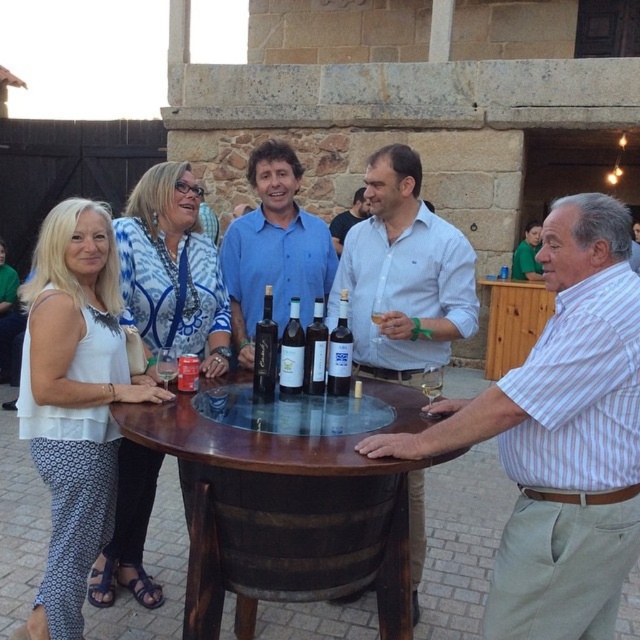
What do you see at coordinates (561, 436) in the screenshot?
I see `white striped shirt at center` at bounding box center [561, 436].

Find the location of a particular element. This screenshot has width=640, height=640. white striped shirt at center is located at coordinates (561, 436).

Where is `white striped shirt at center`? The height and width of the screenshot is (640, 640). white striped shirt at center is located at coordinates (561, 436).

Is white printed fabric blouse at left taller than translucent glass bottle at center?

Correct, white printed fabric blouse at left is much taller as translucent glass bottle at center.

Describe the element at coordinates (74, 401) in the screenshot. I see `white printed fabric blouse at left` at that location.

Image resolution: width=640 pixels, height=640 pixels. I want to click on white printed fabric blouse at left, so click(x=74, y=401).

Is white striped shirt at center in front of matte glass bottles at center?

Yes, it is in front of matte glass bottles at center.

Between point (493, 611) and point (314, 317), which one is positioned behind?

Point (314, 317)

This screenshot has width=640, height=640. Describe the element at coordinates (561, 436) in the screenshot. I see `white striped shirt at center` at that location.

Where is `white striped shirt at center`? The image size is (640, 640). white striped shirt at center is located at coordinates (561, 436).